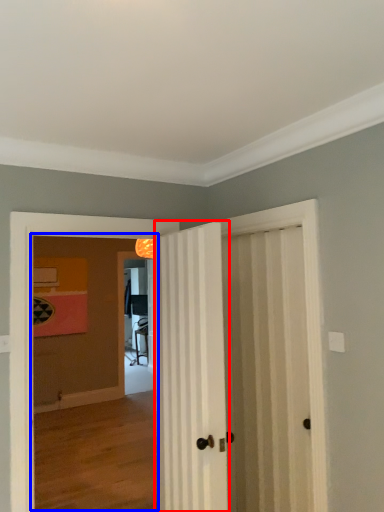
Question: Which object appears farthest to the camera in this image, door (highlighted by a red box) or corridor (highlighted by a blue box)?

Choices:
 (A) door
 (B) corridor

Answer: (B)